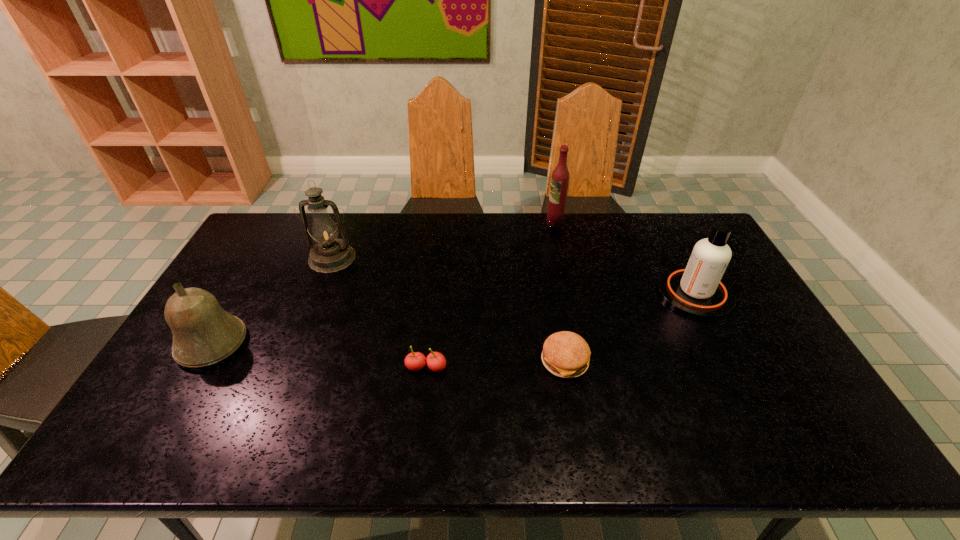
Find the location of `free space at the left edge of the desktop`. free space at the left edge of the desktop is located at coordinates (232, 278).

Find the location of `vacant region between the second object from left to right and the rightmost object`. vacant region between the second object from left to right and the rightmost object is located at coordinates (514, 275).

Locate an element on the screen. empty space that is in between the cleansing agent and the cherry is located at coordinates (561, 330).

Identify the location of empty space that is in between the liquor and the hamburger. The width and height of the screenshot is (960, 540). (560, 292).

Where is `vacant region between the bell and the cherry`? vacant region between the bell and the cherry is located at coordinates (319, 356).

Where is `unoccupied position between the cleansing agent and the second object from left to right`? unoccupied position between the cleansing agent and the second object from left to right is located at coordinates (514, 275).

Locate an element on the screen. free point between the fourth object from right to left and the leftmost object is located at coordinates (319, 356).

The width and height of the screenshot is (960, 540). I want to click on vacant region between the bell and the cleansing agent, so click(x=453, y=318).

Where is `unoccupied position between the second object from left to right and the farthest object`? unoccupied position between the second object from left to right and the farthest object is located at coordinates (444, 240).

Locate an element on the screen. empty space between the hamburger and the cherry is located at coordinates click(x=495, y=364).